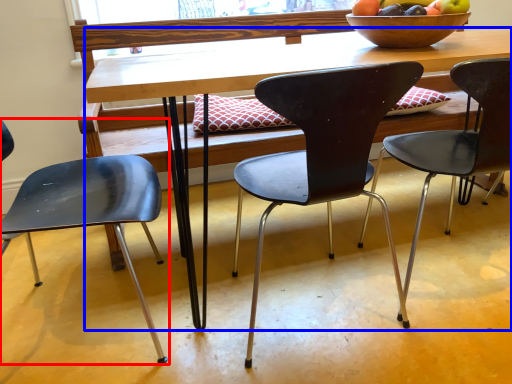
Question: Which of the following is the closest to the observer, chair (highlighted by a red box) or desk (highlighted by a blue box)?

Choices:
 (A) chair
 (B) desk

Answer: (A)